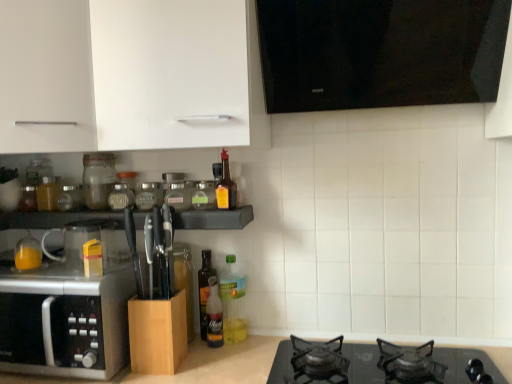
Where is `vacant area that lies to the right of translucent glass bottle at left, which appears as the fifth bottle when viewed from the right`? vacant area that lies to the right of translucent glass bottle at left, which appears as the fifth bottle when viewed from the right is located at coordinates (76, 273).